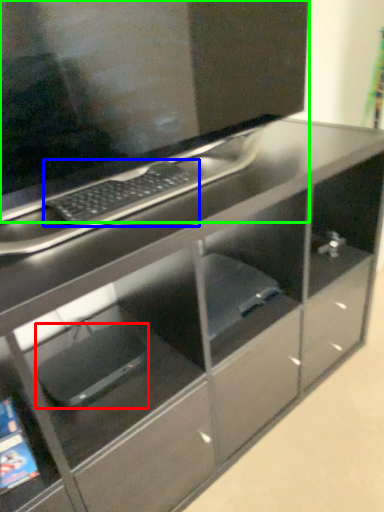
Question: Based on their relative distances, which object is farther from computer (highlighted by a red box)? Choose from computer keyboard (highlighted by a blue box) and computer monitor (highlighted by a green box).

Choices:
 (A) computer keyboard
 (B) computer monitor

Answer: (B)